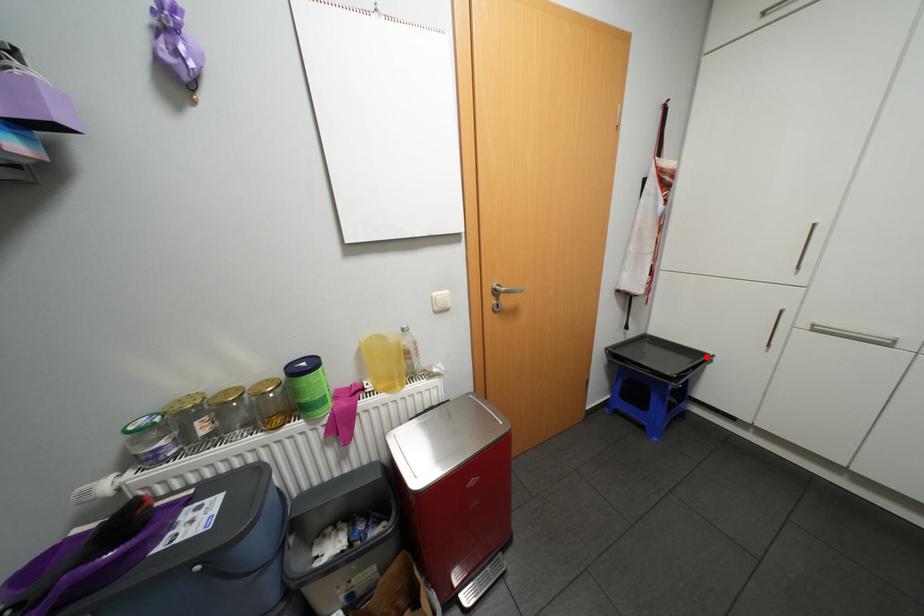
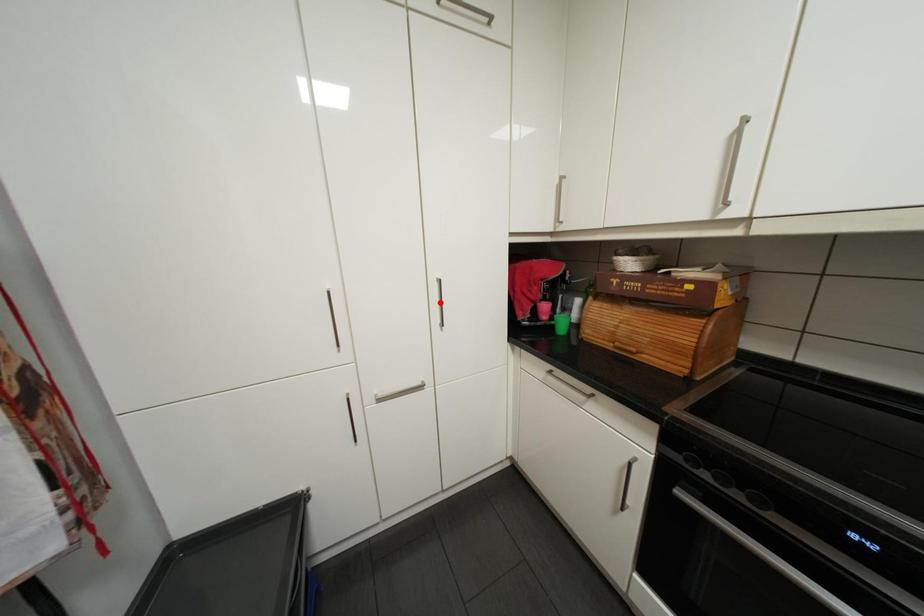
I am providing you with two images of the same scene from different viewpoints. A red point is marked on the first image and another point is marked on the second image. Do the highlighted points in image1 and image2 indicate the same real-world spot?

No